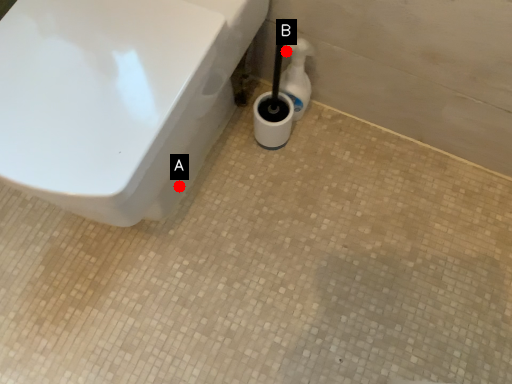
Question: Two points are circled on the image, labeled by A and B beside each circle. Which point appears closest to the camera in this image?

Choices:
 (A) A is closer
 (B) B is closer

Answer: (B)